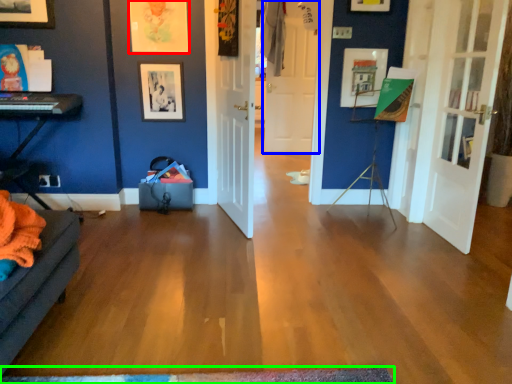
Question: Which is nearer to the picture frame (highlighted by a red box)? door (highlighted by a blue box) or doormat (highlighted by a green box).

Choices:
 (A) door
 (B) doormat

Answer: (B)